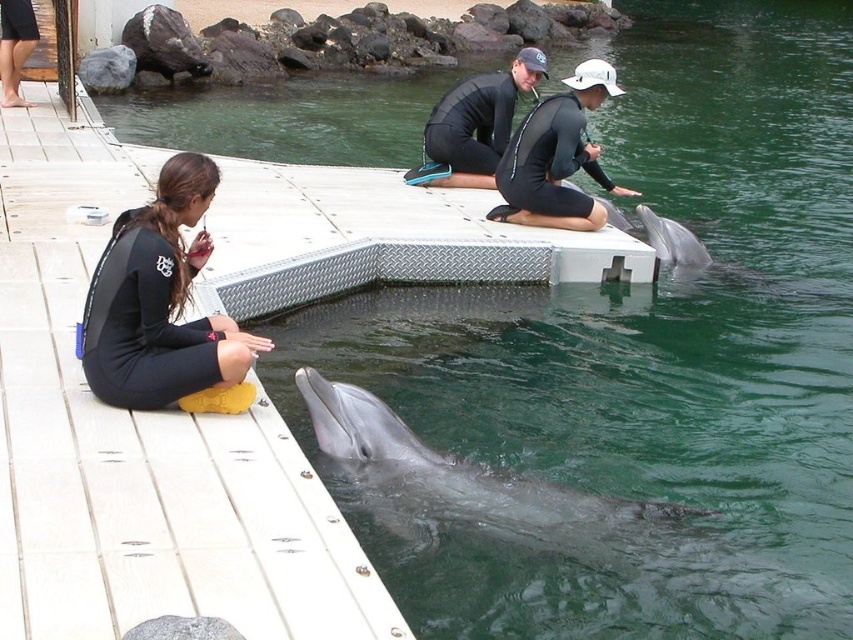
Who is more distant from viewer, (132, 365) or (590, 540)?

Point (590, 540)

Locate an element on the screen. black neoprene wetsuit at left is located at coordinates (160, 301).

Image resolution: width=853 pixels, height=640 pixels. Identify the location of black neoprene wetsuit at left. (160, 301).

Can you confirm if black neoprene wetsuit at left is positioned above black matte wetsuit at center?

Incorrect, black neoprene wetsuit at left is not positioned above black matte wetsuit at center.

Who is shorter, black neoprene wetsuit at left or black matte wetsuit at center?

black matte wetsuit at center

Where is `black neoprene wetsuit at left`? black neoprene wetsuit at left is located at coordinates pyautogui.click(x=160, y=301).

Can you confirm if black neoprene wetsuit at left is bigger than gray smooth dolphin at right?

No, black neoprene wetsuit at left is not bigger than gray smooth dolphin at right.

Which is more to the right, black neoprene wetsuit at left or gray smooth dolphin at right?

Positioned to the right is gray smooth dolphin at right.

Between point (213, 330) and point (793, 278), which one is positioned behind?

Positioned behind is point (793, 278).

You are a GUI agent. You are given a task and a screenshot of the screen. Output one action in this format:
    pyautogui.click(x=<x>, y=<y>)
    Task: Click on the black neoprene wetsuit at left
    The width and height of the screenshot is (853, 640).
    Given the screenshot: What is the action you would take?
    pyautogui.click(x=160, y=301)